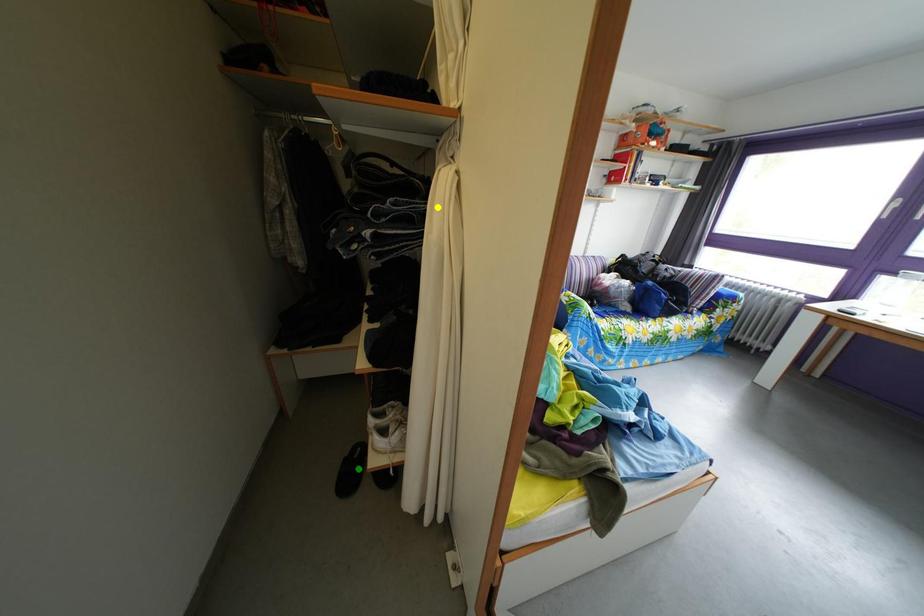
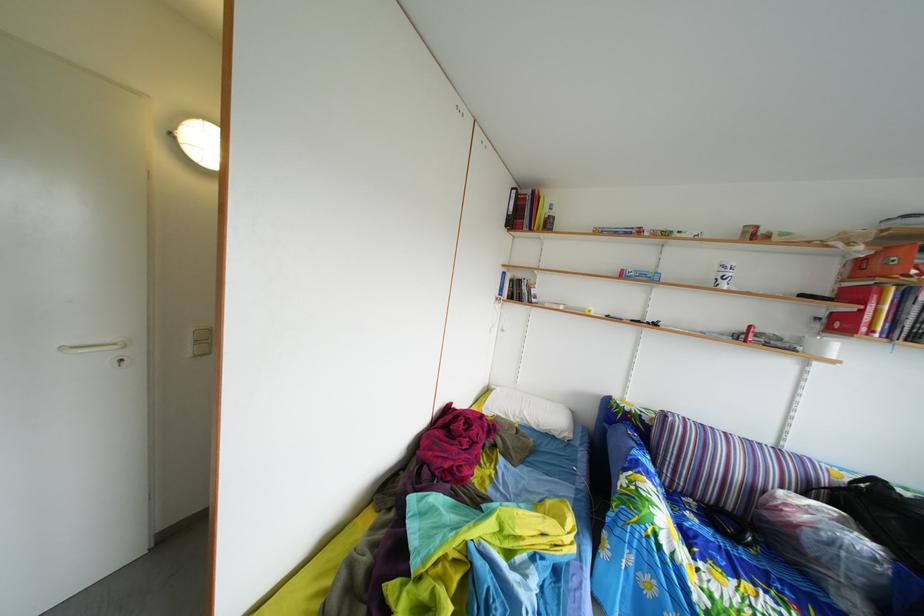
I am providing you with two images of the same scene from different viewpoints. Three points are marked in image1. Which point corresponds to a part or object that is occluded in image2?In image1, three points are marked. Which of them correspond to a part or object that is occluded in image2?Among the three points shown in image1, which one corresponds to a part or object that is no longer visible due to occlusion in image2?

blue point, yellow point, green point cannot be seen in image2.